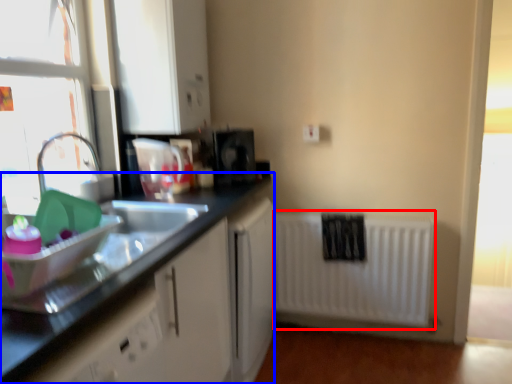
Question: Which object appears closest to the camera in this image, radiator (highlighted by a red box) or countertop (highlighted by a blue box)?

Choices:
 (A) radiator
 (B) countertop

Answer: (B)